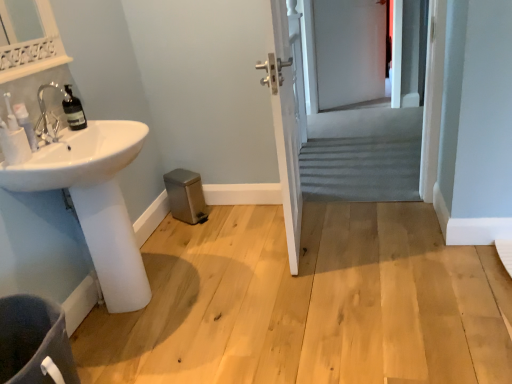
The width and height of the screenshot is (512, 384). Identify the location of vacant area that lies between translucent glass bottle at left and matte white soap dispenser at left. (58, 134).